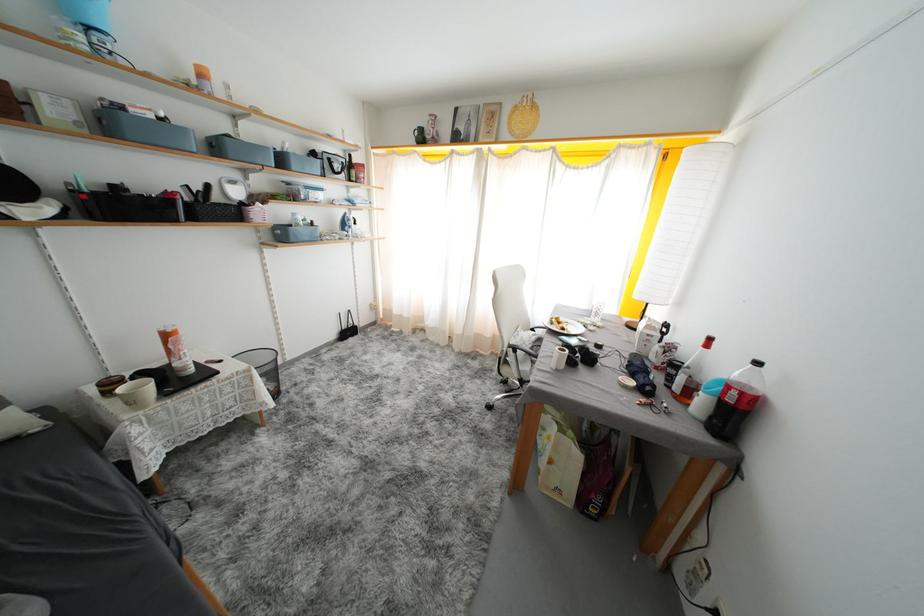
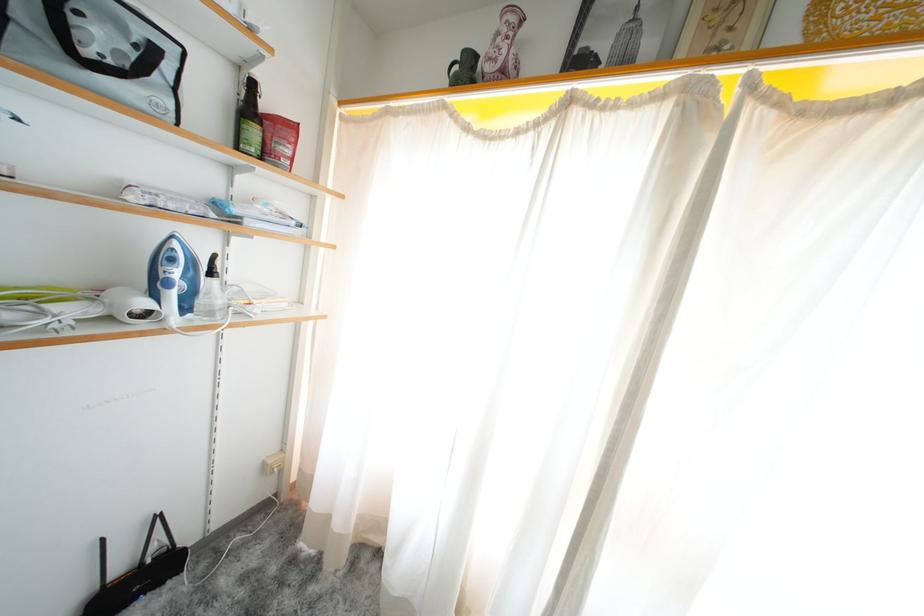
Question: The images are taken continuously from a first-person perspective. In which direction are you moving?

Choices:
 (A) Left
 (B) Right
 (C) Forward
 (D) Backward

Answer: (C)